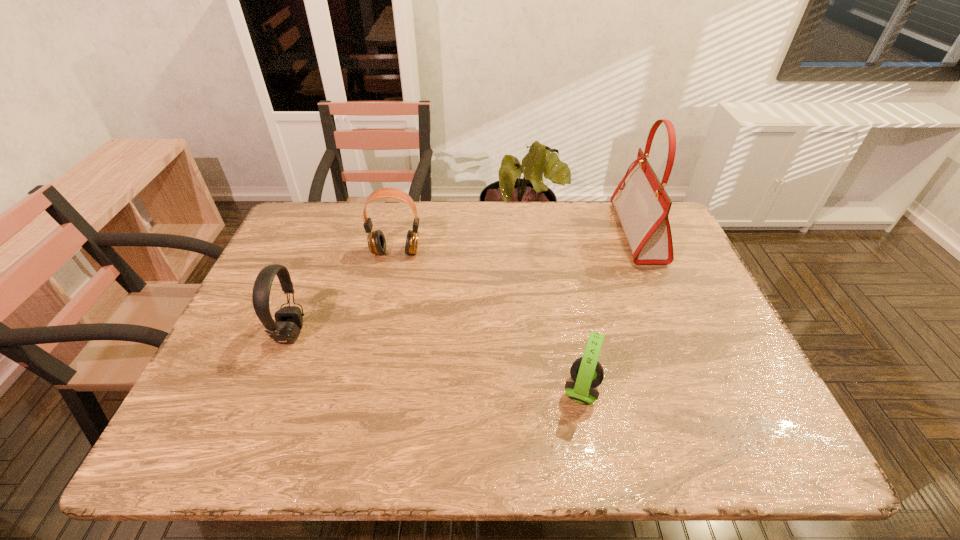
You are a GUI agent. You are given a task and a screenshot of the screen. Output one action in this format:
    pyautogui.click(x=<x>, y=<y>)
    Task: Click on the free space located on the front-facing side of the leftmost object
    
    Given the screenshot: What is the action you would take?
    pyautogui.click(x=357, y=333)

This screenshot has width=960, height=540. I want to click on free space located on the left of the shortest object, so click(x=539, y=390).

The image size is (960, 540). Identify the location of handbag at the far edge. (642, 204).

I want to click on headset at the far edge, so click(376, 240).

Identify the location of object positioned at the near edge. (587, 373).

The width and height of the screenshot is (960, 540). Find the location of `object that is at the left edge`. object that is at the left edge is located at coordinates (288, 323).

The height and width of the screenshot is (540, 960). What are the coordinates of `object at the right edge` in the screenshot? It's located at (642, 204).

Find the location of a particular element. This screenshot has width=960, height=540. object that is at the far right corner is located at coordinates (642, 204).

The width and height of the screenshot is (960, 540). In order to click on vacant space at the far edge of the desktop in this screenshot , I will do `click(542, 219)`.

This screenshot has width=960, height=540. In the image, there is a desktop. Identify the location of free space at the near edge. (642, 434).